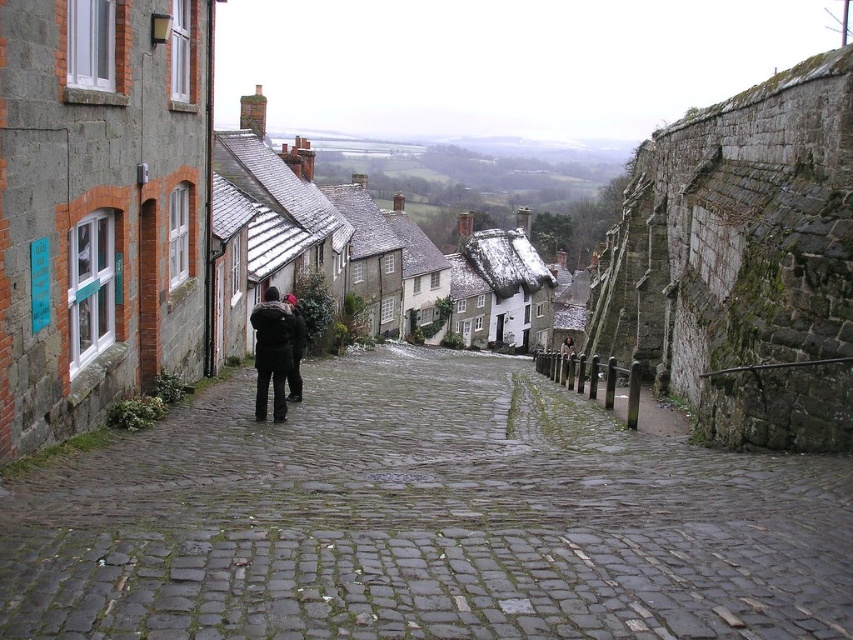
You are a traveler standing in the middle of the rough cobblestone alley at center and the black fabric jacket at center. Which object takes up more space in the scene?

The rough cobblestone alley at center takes up more space in the scene than the black fabric jacket at center because it is bigger.